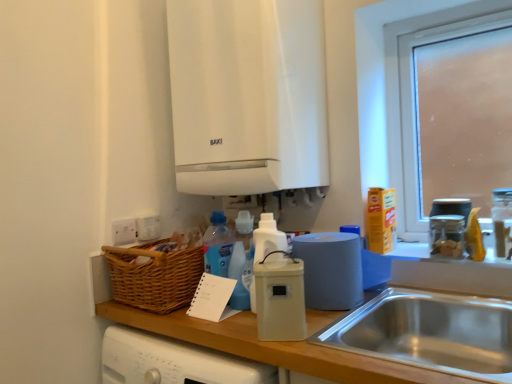
Question: Should I look upward or downward to see white plastic container at center, which appears as the second kitchen appliance when viewed from the back?

Choices:
 (A) down
 (B) up

Answer: (A)

Question: From the image's perspective, would you say blue matte paper towel roll at right is shown under matte plastic roll of paper towels at center, arranged as the first kitchen appliance when viewed from the back?

Choices:
 (A) no
 (B) yes

Answer: (A)

Question: Does blue matte paper towel roll at right have a greater width compared to matte plastic roll of paper towels at center, the second kitchen appliance positioned from the front?

Choices:
 (A) no
 (B) yes

Answer: (B)

Question: Can you confirm if blue matte paper towel roll at right is shorter than matte plastic roll of paper towels at center, the second kitchen appliance positioned from the front?

Choices:
 (A) no
 (B) yes

Answer: (B)

Question: Could you tell me if blue matte paper towel roll at right is facing matte plastic roll of paper towels at center, the second kitchen appliance positioned from the front?

Choices:
 (A) yes
 (B) no

Answer: (A)

Question: Does blue matte paper towel roll at right have a smaller size compared to matte plastic roll of paper towels at center, arranged as the first kitchen appliance when viewed from the back?

Choices:
 (A) yes
 (B) no

Answer: (A)

Question: Is blue matte paper towel roll at right in front of matte plastic roll of paper towels at center, arranged as the first kitchen appliance when viewed from the back?

Choices:
 (A) yes
 (B) no

Answer: (B)

Question: Does blue matte paper towel roll at right turn towards clear glass jar at upper right, placed as the 2th bottle when sorted from left to right?

Choices:
 (A) yes
 (B) no

Answer: (B)

Question: From the image's perspective, would you say blue matte paper towel roll at right is shown under clear glass jar at upper right, placed as the 2th bottle when sorted from left to right?

Choices:
 (A) no
 (B) yes

Answer: (B)

Question: Is blue matte paper towel roll at right positioned before clear glass jar at upper right, placed as the first bottle when sorted from right to left?

Choices:
 (A) yes
 (B) no

Answer: (B)

Question: From a real-world perspective, is blue matte paper towel roll at right located beneath clear glass jar at upper right, placed as the first bottle when sorted from right to left?

Choices:
 (A) no
 (B) yes

Answer: (B)

Question: Is blue matte paper towel roll at right surrounding clear glass jar at upper right, placed as the 2th bottle when sorted from left to right?

Choices:
 (A) yes
 (B) no

Answer: (B)

Question: Can you confirm if blue matte paper towel roll at right is bigger than clear glass jar at upper right, placed as the 2th bottle when sorted from left to right?

Choices:
 (A) no
 (B) yes

Answer: (B)

Question: From the image's perspective, would you say white plastic bottle at center, acting as the 2th bottle starting from the right, is shown under frosted glass window at upper right?

Choices:
 (A) yes
 (B) no

Answer: (A)